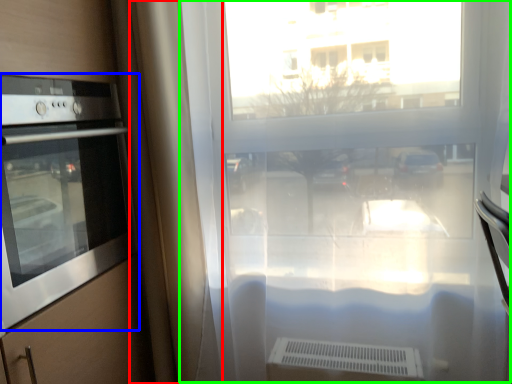
Question: Which is farther away from curtain (highlighted by a red box)? home appliance (highlighted by a blue box) or window frame (highlighted by a green box)?

Choices:
 (A) home appliance
 (B) window frame

Answer: (B)